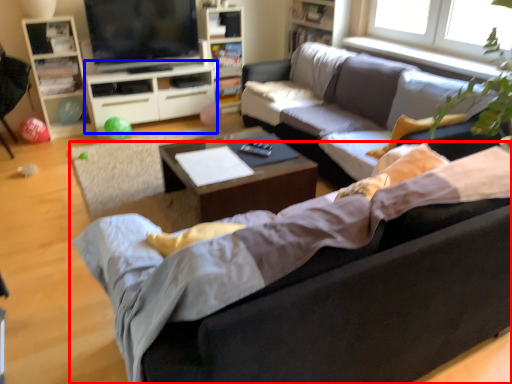
Question: Which object is closer to the camera taking this photo, studio couch (highlighted by a red box) or entertainment center (highlighted by a blue box)?

Choices:
 (A) studio couch
 (B) entertainment center

Answer: (A)